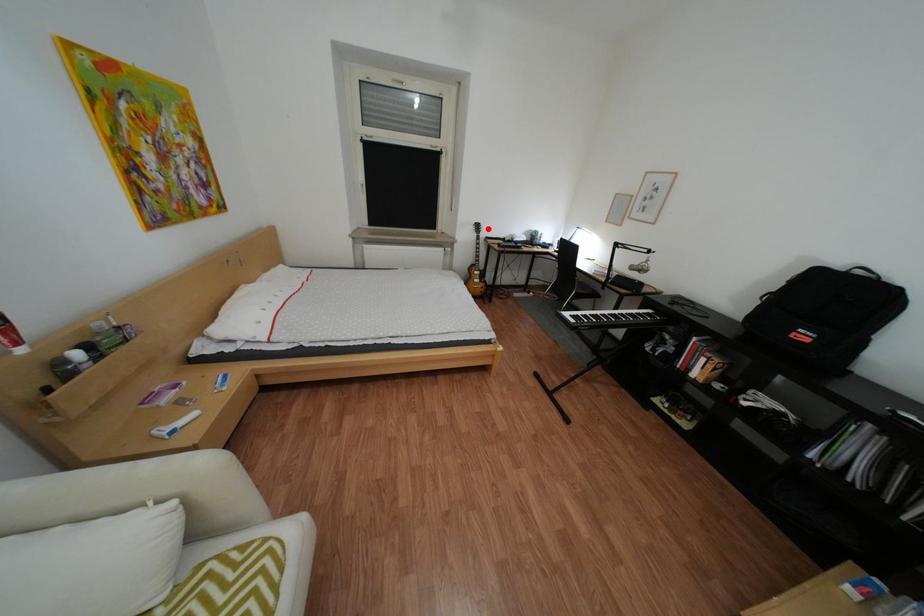
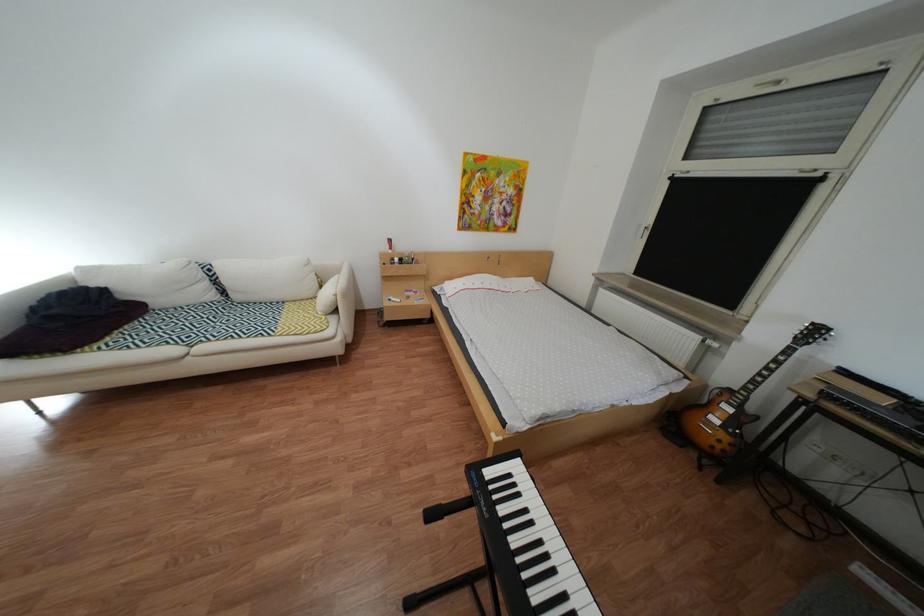
Question: A red point is marked in image1. In image2, is the corresponding 3D point closer to the camera or farther? Reply with the corresponding letter.

Choices:
 (A) The corresponding 3D point is closer.
 (B) The corresponding 3D point is farther.

Answer: (B)